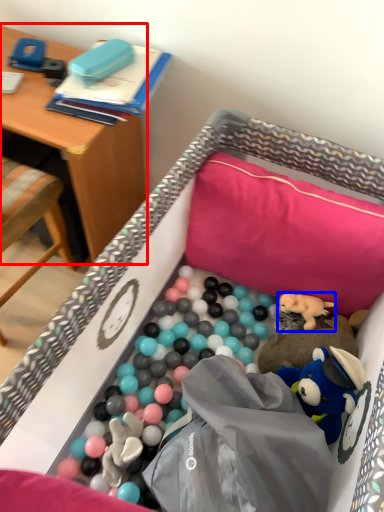
Question: Which point is further to the camera, desk (highlighted by a red box) or toy (highlighted by a blue box)?

Choices:
 (A) desk
 (B) toy

Answer: (B)